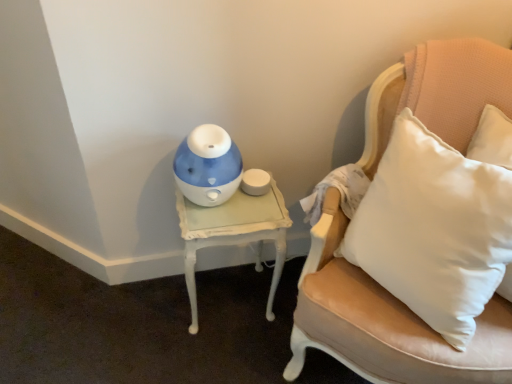
Question: From the image's perspective, is leather cushion at right above blue glossy humidifier at center?

Choices:
 (A) no
 (B) yes

Answer: (A)

Question: Considering the relative positions of leather cushion at right and blue glossy humidifier at center in the image provided, is leather cushion at right in front of blue glossy humidifier at center?

Choices:
 (A) no
 (B) yes

Answer: (B)

Question: Considering the relative sizes of leather cushion at right and blue glossy humidifier at center in the image provided, is leather cushion at right wider than blue glossy humidifier at center?

Choices:
 (A) yes
 (B) no

Answer: (A)

Question: Does leather cushion at right appear on the left side of blue glossy humidifier at center?

Choices:
 (A) no
 (B) yes

Answer: (A)

Question: Is leather cushion at right looking in the opposite direction of blue glossy humidifier at center?

Choices:
 (A) no
 (B) yes

Answer: (A)

Question: From a real-world perspective, is leather cushion at right on blue glossy humidifier at center?

Choices:
 (A) no
 (B) yes

Answer: (A)

Question: Is white painted wood table at left turned away from blue glossy humidifier at center?

Choices:
 (A) yes
 (B) no

Answer: (B)

Question: Is blue glossy humidifier at center located within white painted wood table at left?

Choices:
 (A) yes
 (B) no

Answer: (B)

Question: Does white painted wood table at left have a larger size compared to blue glossy humidifier at center?

Choices:
 (A) no
 (B) yes

Answer: (B)

Question: Are white painted wood table at left and blue glossy humidifier at center far apart?

Choices:
 (A) no
 (B) yes

Answer: (A)

Question: Is white painted wood table at left located outside blue glossy humidifier at center?

Choices:
 (A) no
 (B) yes

Answer: (B)

Question: Is white painted wood table at left with blue glossy humidifier at center?

Choices:
 (A) yes
 (B) no

Answer: (B)

Question: From a real-world perspective, is blue glossy humidifier at center located beneath white painted wood table at left?

Choices:
 (A) yes
 (B) no

Answer: (B)